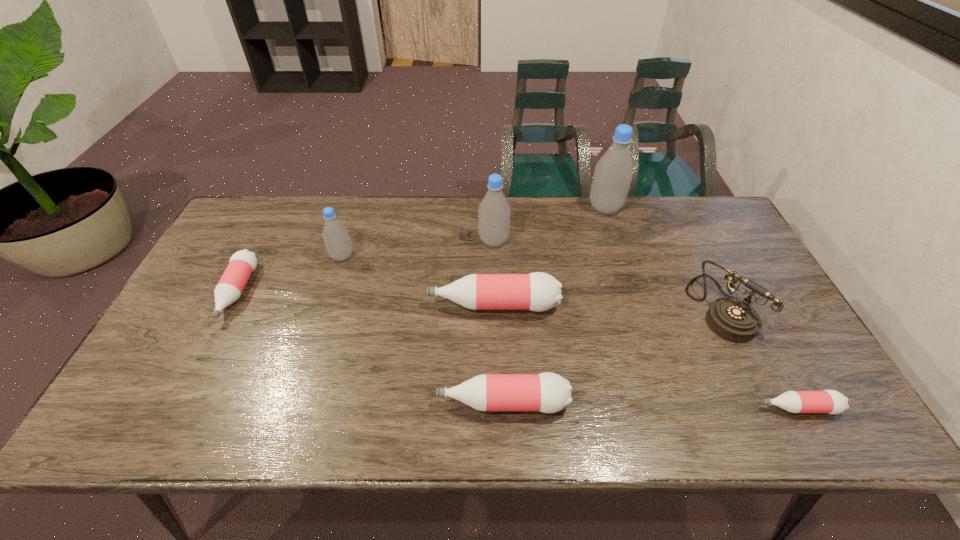
Locate an element on the screen. The width and height of the screenshot is (960, 540). vacant area between the tallest bottle and the leftmost pink bottle is located at coordinates (421, 250).

Find the location of a particular element. free spot between the third tallest bottle and the rightmost pink bottle is located at coordinates (570, 332).

The image size is (960, 540). I want to click on free spot between the third shortest object and the rightmost bottle, so tap(651, 405).

Find the location of `free space between the second tallest object and the leftmost pink bottle`. free space between the second tallest object and the leftmost pink bottle is located at coordinates (366, 266).

Locate an element on the screen. blank region between the shortest bottle and the fourth tallest bottle is located at coordinates (646, 356).

The image size is (960, 540). In order to click on empty space between the smallest pink bottle and the biggest pink bottle in this screenshot , I will do `click(646, 356)`.

Locate an element on the screen. This screenshot has height=540, width=960. object that stands as the third closest to the biggest pink bottle is located at coordinates (336, 238).

Where is `object that stands as the fourth closest to the fourth tallest bottle`? This screenshot has width=960, height=540. object that stands as the fourth closest to the fourth tallest bottle is located at coordinates (613, 174).

Identify which bottle is located as the nearest to the rightmost pink bottle. Please provide its 2D coordinates. Your answer should be formatted as a tuple, i.e. [(x, y)], where the tuple contains the x and y coordinates of a point satisfying the conditions above.

[(547, 392)]

Locate an element on the screen. Image resolution: width=960 pixels, height=540 pixels. the sixth closest bottle to the second tallest object is located at coordinates (827, 401).